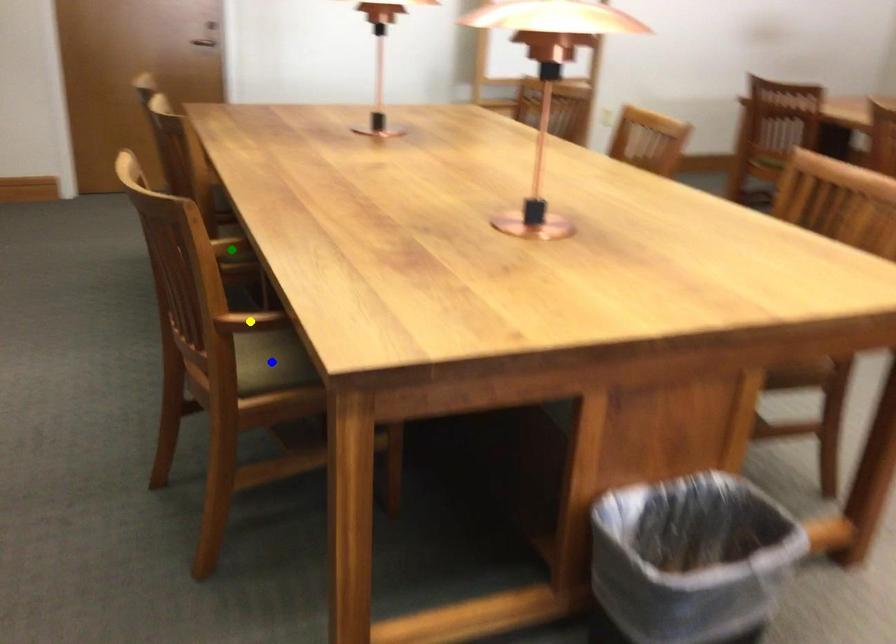
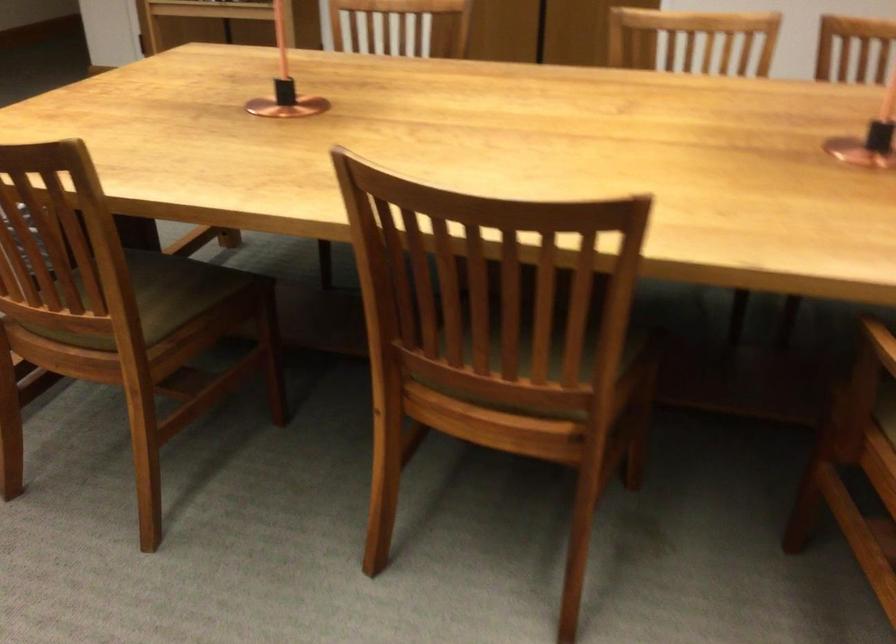
I am providing you with two images of the same scene from different viewpoints. Three points are marked in image1. Which point corresponds to a part or object that is occluded in image2?In image1, three points are marked. Which of them correspond to a part or object that is occluded in image2?Among the three points shown in image1, which one corresponds to a part or object that is no longer visible due to occlusion in image2?

yellow point, green point, blue point